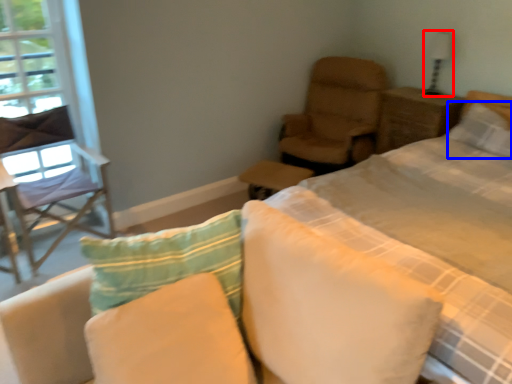
Question: Among these objects, which one is nearest to the camera, table lamp (highlighted by a red box) or pillow (highlighted by a blue box)?

Choices:
 (A) table lamp
 (B) pillow

Answer: (B)